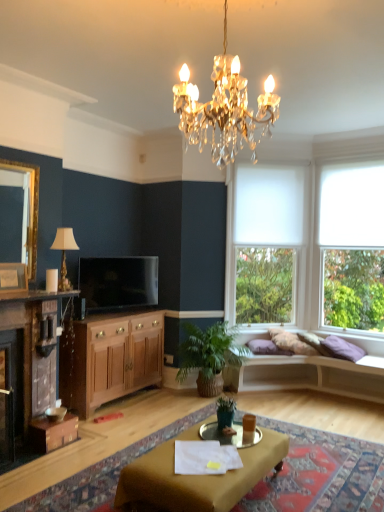
Question: Would you consider transparent glass window at right, which is the second window in left-to-right order, to be distant from purple velvet pillow at right?

Choices:
 (A) yes
 (B) no

Answer: (A)

Question: Is transparent glass window at right, which is the second window in left-to-right order, placed right next to purple velvet pillow at right?

Choices:
 (A) yes
 (B) no

Answer: (B)

Question: Does transparent glass window at right, which is the second window in left-to-right order, have a greater height compared to purple velvet pillow at right?

Choices:
 (A) no
 (B) yes

Answer: (B)

Question: Can you confirm if transparent glass window at right, which is the second window in left-to-right order, is bigger than purple velvet pillow at right?

Choices:
 (A) no
 (B) yes

Answer: (B)

Question: Is purple velvet pillow at right inside transparent glass window at right, which is the second window in left-to-right order?

Choices:
 (A) no
 (B) yes

Answer: (A)

Question: From a real-world perspective, is green woven basket at lower center, which ranks as the second houseplant in front-to-back order, physically located above or below wooden cabinet at lower left?

Choices:
 (A) above
 (B) below

Answer: (B)

Question: From the image's perspective, is green woven basket at lower center, marked as the 1th houseplant in a back-to-front arrangement, above or below wooden cabinet at lower left?

Choices:
 (A) above
 (B) below

Answer: (B)

Question: Considering their positions, is green woven basket at lower center, marked as the 1th houseplant in a back-to-front arrangement, located in front of or behind wooden cabinet at lower left?

Choices:
 (A) behind
 (B) front

Answer: (A)

Question: Based on their sizes in the image, would you say green woven basket at lower center, which ranks as the second houseplant in front-to-back order, is bigger or smaller than wooden cabinet at lower left?

Choices:
 (A) small
 (B) big

Answer: (A)

Question: From the image's perspective, is wooden cabinet at lower left located above or below matte gold picture frame at left?

Choices:
 (A) below
 (B) above

Answer: (A)

Question: In terms of height, does wooden cabinet at lower left look taller or shorter compared to matte gold picture frame at left?

Choices:
 (A) short
 (B) tall

Answer: (B)

Question: Choose the correct answer: Is wooden cabinet at lower left inside matte gold picture frame at left or outside it?

Choices:
 (A) inside
 (B) outside

Answer: (B)

Question: Considering the positions of point (105, 315) and point (23, 281), is point (105, 315) closer or farther from the camera than point (23, 281)?

Choices:
 (A) farther
 (B) closer

Answer: (A)

Question: Looking at the image, does transparent glass window at right, placed as the first window when sorted from right to left, seem bigger or smaller compared to wooden cabinet at lower left?

Choices:
 (A) small
 (B) big

Answer: (A)

Question: Considering the positions of transparent glass window at right, placed as the first window when sorted from right to left, and wooden cabinet at lower left in the image, is transparent glass window at right, placed as the first window when sorted from right to left, taller or shorter than wooden cabinet at lower left?

Choices:
 (A) short
 (B) tall

Answer: (B)